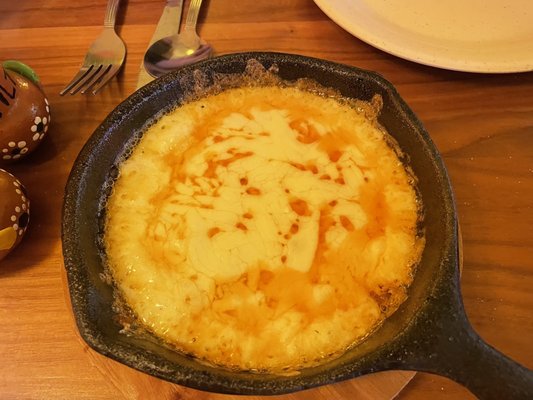
Where is `butter knife`? butter knife is located at coordinates (165, 29).